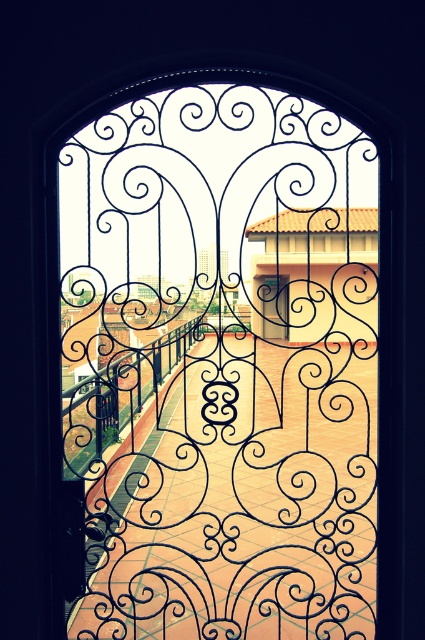
You are standing in a courtyard and want to exit through the black wrought iron gate at center. However, there is a matte black door at center blocking your path. Can you walk through the gate without opening the door?

The black wrought iron gate at center is positioned under the matte black door at center, so you can walk through the gate without needing to open the door since it is located below the door.

You are standing in front of a doorway with both the black wrought iron gate at center and the matte black door at center. You need to pass through the narrower opening. Which one should you choose?

The black wrought iron gate at center has a lesser width compared to matte black door at center, so you should choose the black wrought iron gate at center to pass through the narrower opening.